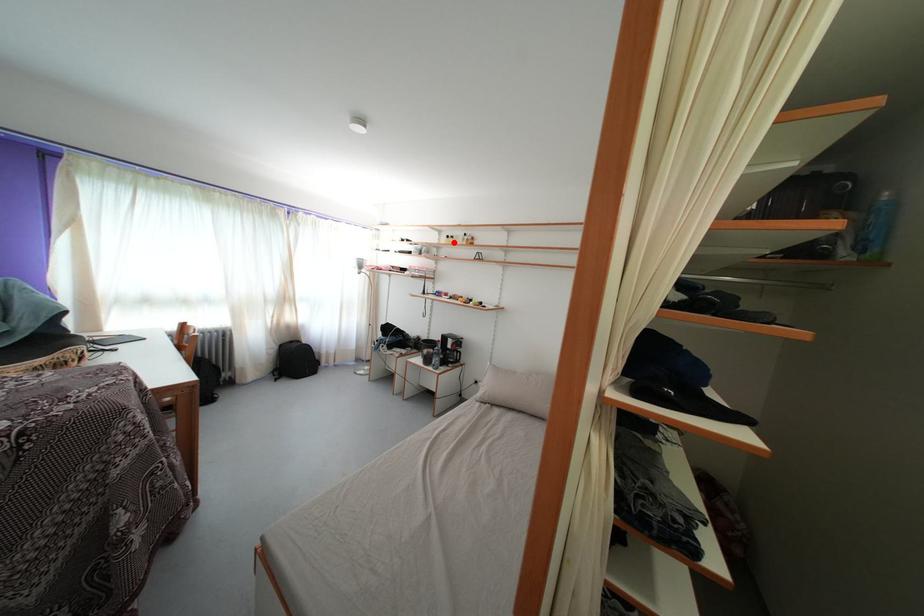
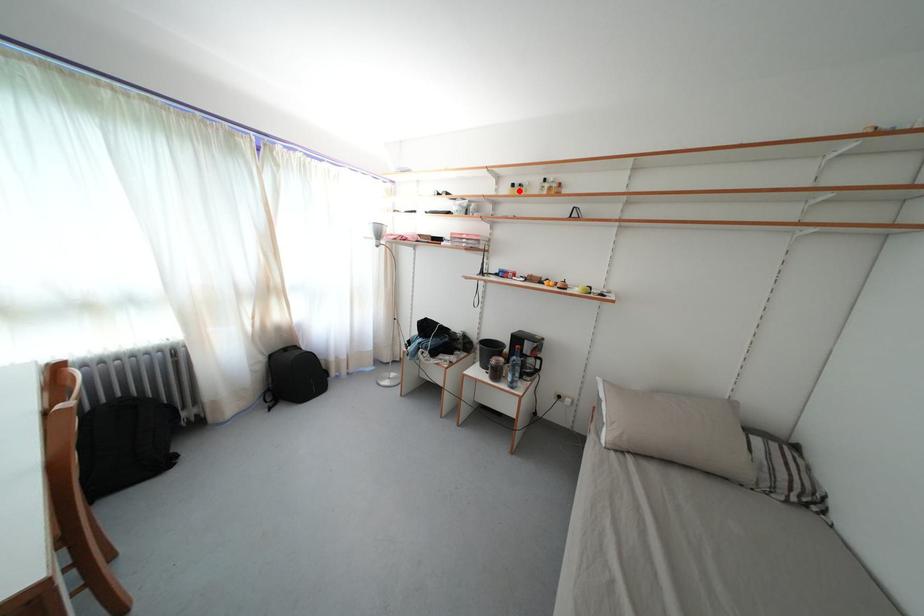
I am providing you with two images of the same scene from different viewpoints. A red point is marked on the first image and another point is marked on the second image. Is the red point in image1 aligned with the point shown in image2?

Yes